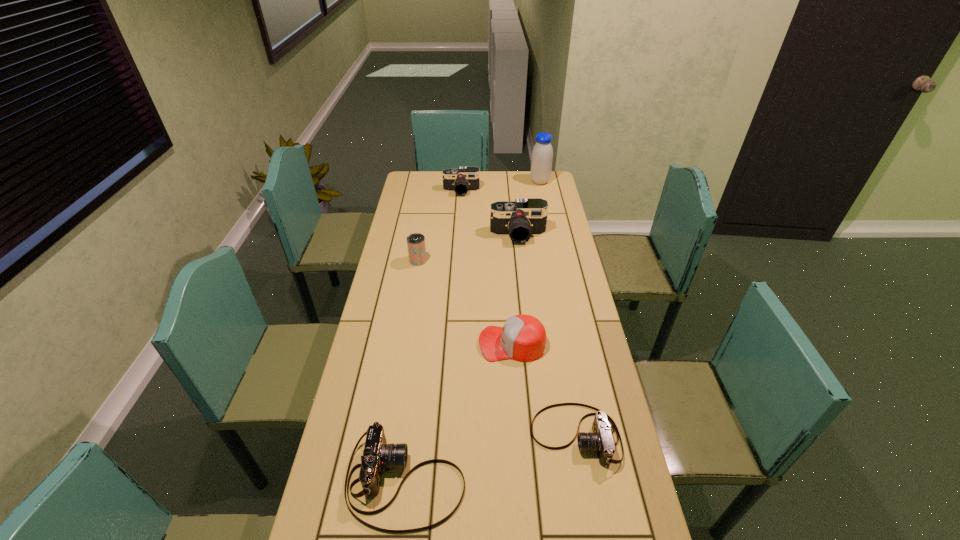
This screenshot has height=540, width=960. I want to click on the tallest object, so click(x=542, y=155).

Locate an element on the screen. blue soya milk is located at coordinates (542, 155).

At what (x,y) coordinates should I click in order to perform the action: click on the second farthest camera. Please return your answer as a coordinate pair (x, y). This screenshot has width=960, height=540. Looking at the image, I should click on (525, 217).

Locate an element on the screen. The width and height of the screenshot is (960, 540). the nearer black camera is located at coordinates (525, 217).

Identify the location of the fourth nearest object. This screenshot has height=540, width=960. (416, 246).

The width and height of the screenshot is (960, 540). Find the location of `red beer can`. red beer can is located at coordinates (416, 246).

Locate an element on the screen. The image size is (960, 540). the farthest camera is located at coordinates (465, 179).

You are a GUI agent. You are given a task and a screenshot of the screen. Output one action in this format:
    pyautogui.click(x=<x>, y=<y>)
    Task: Click on the left black camera
    
    Given the screenshot: What is the action you would take?
    pyautogui.click(x=465, y=179)

The width and height of the screenshot is (960, 540). I want to click on red baseball cap, so click(x=522, y=338).

The height and width of the screenshot is (540, 960). I want to click on the fifth farthest object, so 522,338.